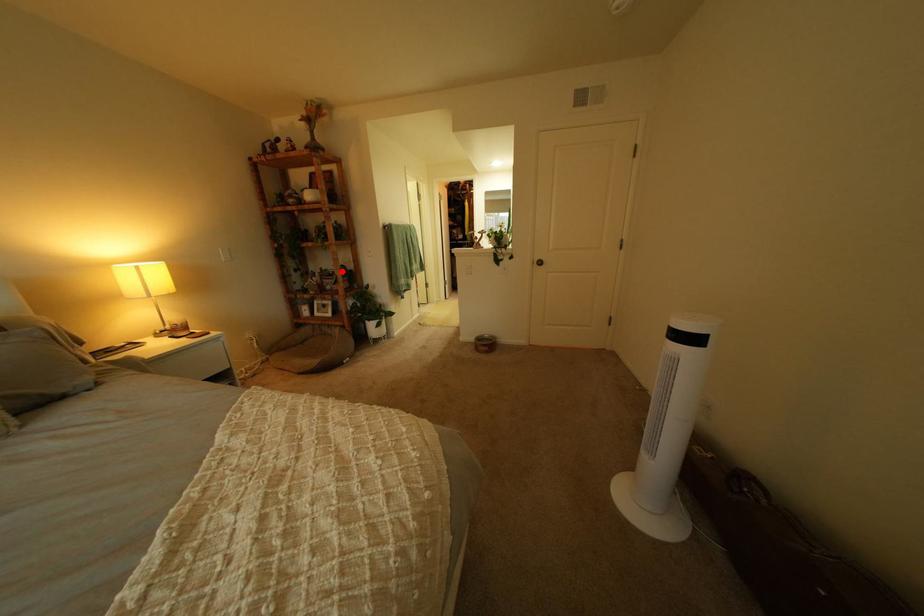
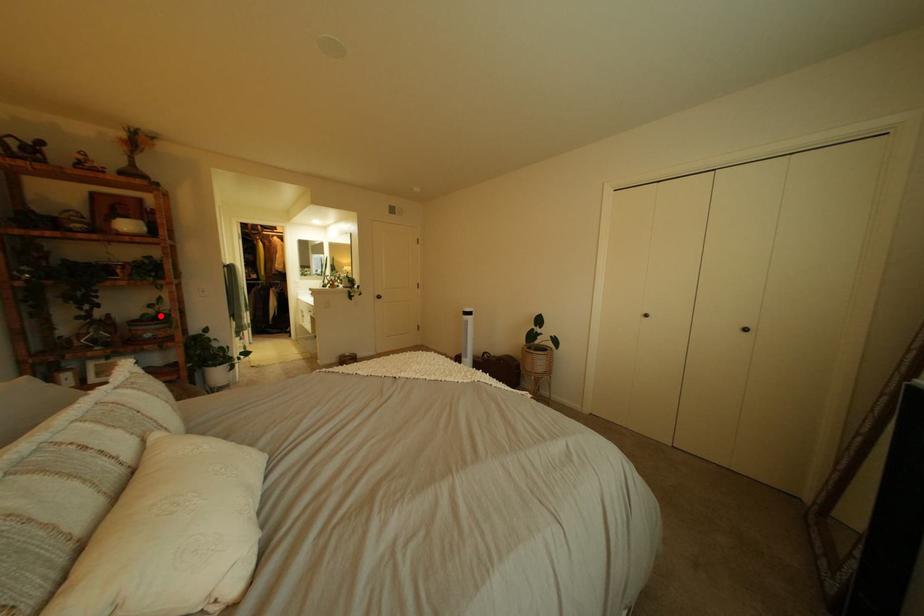
From the picture: I am providing you with two images of the same scene from different viewpoints. A red point is marked on the first image and another point is marked on the second image. Is the marked point in image1 the same physical position as the marked point in image2?

Yes